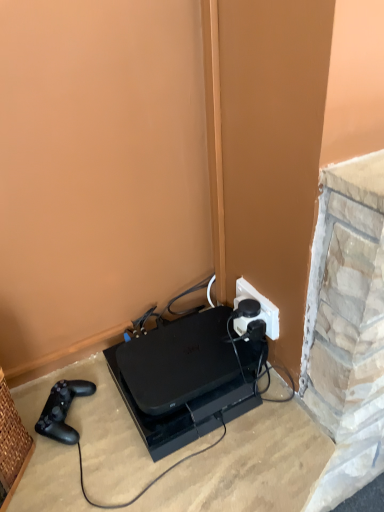
The image size is (384, 512). Find the location of `free location in front of black matte game controller at lower left`. free location in front of black matte game controller at lower left is located at coordinates (72, 474).